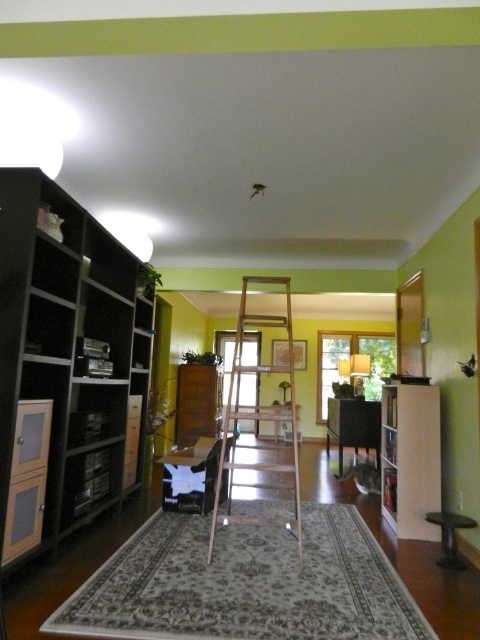
Question: In this image, where is wooden ladder at center located relative to black plastic stool at lower right?

Choices:
 (A) left
 (B) right

Answer: (A)

Question: Which object is positioned farthest from the matte black chair at center?

Choices:
 (A) black matte bookshelf at left
 (B) black plastic stool at lower right

Answer: (A)

Question: Observing the image, what is the correct spatial positioning of white matte bookshelf at right in reference to black plastic stool at lower right?

Choices:
 (A) above
 (B) below

Answer: (A)

Question: Which point is closer to the camera taking this photo?

Choices:
 (A) (50, 193)
 (B) (338, 467)
 (C) (393, 449)

Answer: (A)

Question: Considering the real-world distances, which object is farthest from the black matte bookshelf at left?

Choices:
 (A) white matte bookshelf at right
 (B) matte black chair at center

Answer: (B)

Question: Is black matte bookshelf at left bigger than wooden ladder at center?

Choices:
 (A) yes
 (B) no

Answer: (A)